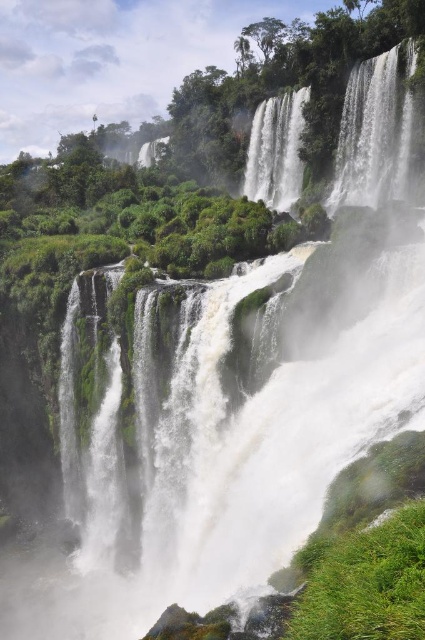
Question: Does white frothy water at upper right have a greater width compared to white frothy water at center?

Choices:
 (A) no
 (B) yes

Answer: (A)

Question: Among these points, which one is farthest from the camera?

Choices:
 (A) (252, 182)
 (B) (340, 124)

Answer: (A)

Question: Which of the following is the farthest from the observer?

Choices:
 (A) white frothy water at upper right
 (B) white frothy water at center

Answer: (B)

Question: Is white frothy water at upper right positioned before white frothy water at center?

Choices:
 (A) yes
 (B) no

Answer: (A)

Question: Does white frothy water at upper right have a lesser width compared to white frothy water at center?

Choices:
 (A) yes
 (B) no

Answer: (A)